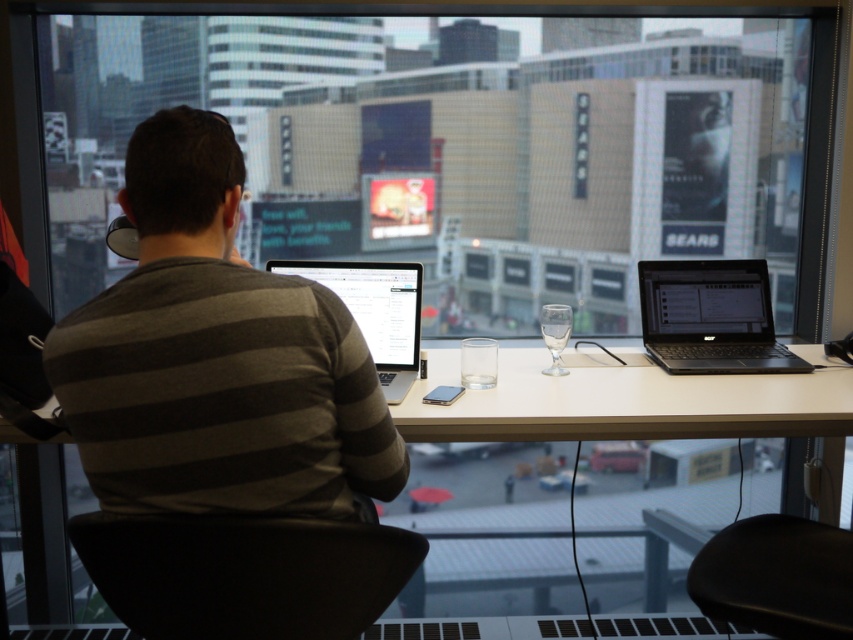
You are organizing a presentation and need to place a large poster on the desk. Given the sizes of the objects, will the poster fit on the white glossy computer desk at center without overlapping the silver metallic laptop at center?

The white glossy computer desk at center is bigger than the silver metallic laptop at center, so the poster can fit on the desk without overlapping the laptop.

You are organizing items on your desk and need to place a new item between the black matte laptop at right and the clear glass wine glass at center. Where should you place it to ensure it is centered between them?

The black matte laptop at right is to the right of the clear glass wine glass at center, so placing the new item exactly halfway between their positions would center it between them.